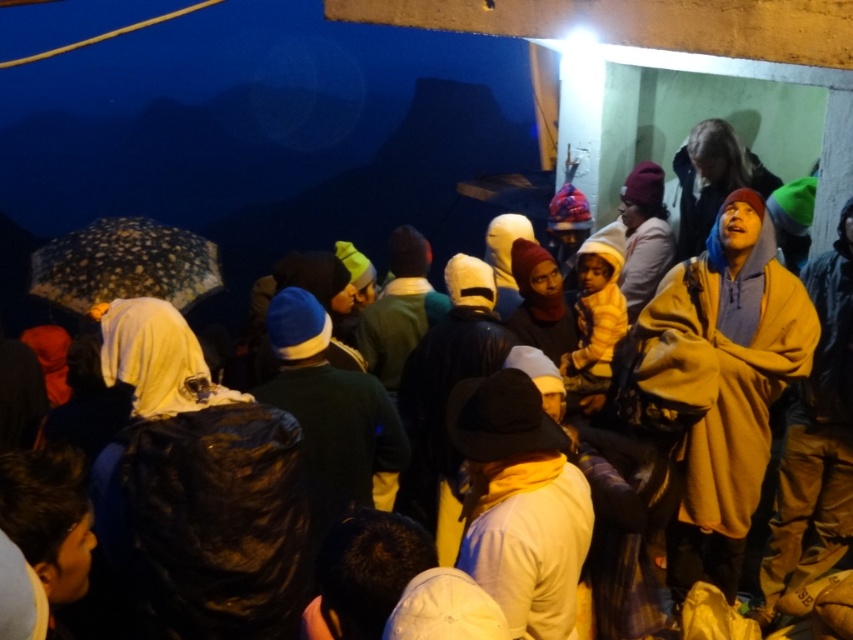
You are a photographer trying to capture a clear shot of both the brown fleece jacket at right and the speckled fabric umbrella at left. Since you want both subjects in focus, which object should you adjust your camera focus on first to ensure depth of field?

The brown fleece jacket at right is closer to the viewer than the speckled fabric umbrella at left. To ensure both are in focus, you should focus on the brown fleece jacket at right first, as it is closer, and use a smaller aperture for greater depth of field coverage.

Consider the image. You are a photographer trying to capture a photo of the group under the speckled fabric umbrella at left. To ensure the brown fleece jacket at right is visible in the frame, where should you position yourself relative to the umbrella?

The brown fleece jacket at right is located below the speckled fabric umbrella at left, so positioning yourself below the umbrella will allow you to see both the umbrella and the jacket in the frame.

You are standing at the center of the scene and want to locate the brown fleece jacket at right. Based on the coordinates provided, in which direction should you look to find it?

The brown fleece jacket at right is located at coordinates point (721, 381), so you should look to the right side of the scene to find it.